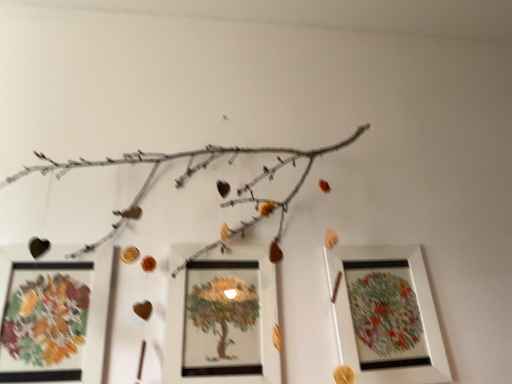
Question: Does matte white picture frame at center, positioned as the 2th picture frame in right-to-left order, lie in front of matte glass picture frame at lower left, the third picture frame from the right?

Choices:
 (A) yes
 (B) no

Answer: (B)

Question: From a real-world perspective, is matte white picture frame at center, positioned as the 2th picture frame in left-to-right order, positioned over matte glass picture frame at lower left, the third picture frame from the right, based on gravity?

Choices:
 (A) no
 (B) yes

Answer: (B)

Question: Can we say matte white picture frame at center, positioned as the 2th picture frame in left-to-right order, lies outside matte glass picture frame at lower left, which ranks as the first picture frame in left-to-right order?

Choices:
 (A) no
 (B) yes

Answer: (B)

Question: Does matte white picture frame at center, positioned as the 2th picture frame in right-to-left order, have a greater width compared to matte glass picture frame at lower left, the third picture frame from the right?

Choices:
 (A) no
 (B) yes

Answer: (B)

Question: Is matte white picture frame at center, positioned as the 2th picture frame in right-to-left order, thinner than matte glass picture frame at lower left, which ranks as the first picture frame in left-to-right order?

Choices:
 (A) no
 (B) yes

Answer: (A)

Question: Is matte white picture frame at center, positioned as the 2th picture frame in left-to-right order, to the left or to the right of white matte picture frame at right, the first picture frame when ordered from right to left, in the image?

Choices:
 (A) left
 (B) right

Answer: (A)

Question: Looking at their shapes, would you say matte white picture frame at center, positioned as the 2th picture frame in left-to-right order, is wider or thinner than white matte picture frame at right, the first picture frame when ordered from right to left?

Choices:
 (A) thin
 (B) wide

Answer: (A)

Question: Is matte white picture frame at center, positioned as the 2th picture frame in right-to-left order, bigger or smaller than white matte picture frame at right, the first picture frame when ordered from right to left?

Choices:
 (A) small
 (B) big

Answer: (A)

Question: From a real-world perspective, is matte white picture frame at center, positioned as the 2th picture frame in right-to-left order, above or below white matte picture frame at right, marked as the third picture frame in a left-to-right arrangement?

Choices:
 (A) above
 (B) below

Answer: (B)

Question: From their relative heights in the image, would you say white matte picture frame at right, the first picture frame when ordered from right to left, is taller or shorter than matte white picture frame at center, positioned as the 2th picture frame in left-to-right order?

Choices:
 (A) tall
 (B) short

Answer: (A)

Question: Is point (359, 334) closer or farther from the camera than point (262, 319)?

Choices:
 (A) farther
 (B) closer

Answer: (A)

Question: Considering the positions of white matte picture frame at right, marked as the third picture frame in a left-to-right arrangement, and matte white picture frame at center, positioned as the 2th picture frame in left-to-right order, in the image, is white matte picture frame at right, marked as the third picture frame in a left-to-right arrangement, bigger or smaller than matte white picture frame at center, positioned as the 2th picture frame in left-to-right order,?

Choices:
 (A) big
 (B) small

Answer: (A)

Question: From the image's perspective, is white matte picture frame at right, marked as the third picture frame in a left-to-right arrangement, above or below matte white picture frame at center, positioned as the 2th picture frame in left-to-right order?

Choices:
 (A) below
 (B) above

Answer: (A)

Question: In terms of height, does matte glass picture frame at lower left, which ranks as the first picture frame in left-to-right order, look taller or shorter compared to white matte picture frame at right, the first picture frame when ordered from right to left?

Choices:
 (A) tall
 (B) short

Answer: (B)

Question: Is matte glass picture frame at lower left, the third picture frame from the right, inside or outside of white matte picture frame at right, marked as the third picture frame in a left-to-right arrangement?

Choices:
 (A) outside
 (B) inside

Answer: (A)